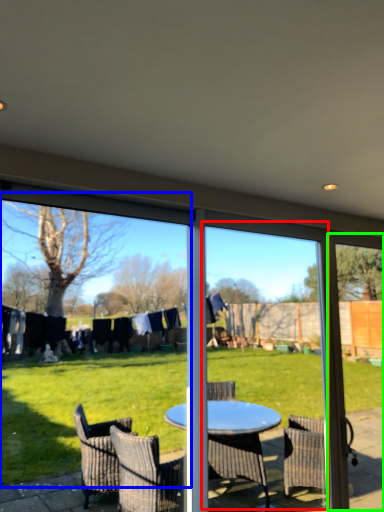
Question: Based on their relative distances, which object is nearer to screen door (highlighted by a red box)? Choose from window screen (highlighted by a blue box) and screen door (highlighted by a green box).

Choices:
 (A) window screen
 (B) screen door

Answer: (A)